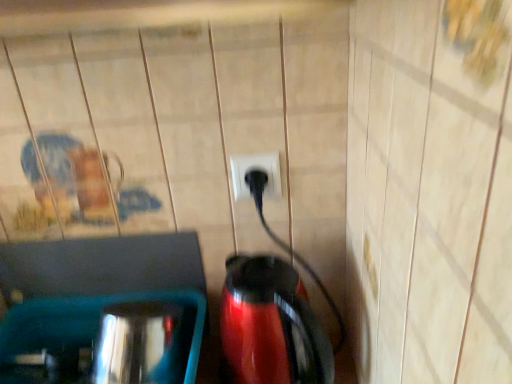
Question: From a real-world perspective, is black plastic plug at center on top of glossy plastic coffee pot at center?

Choices:
 (A) no
 (B) yes

Answer: (B)

Question: Are black plastic plug at center and glossy plastic coffee pot at center far apart?

Choices:
 (A) no
 (B) yes

Answer: (A)

Question: Is black plastic plug at center further to the viewer compared to glossy plastic coffee pot at center?

Choices:
 (A) yes
 (B) no

Answer: (A)

Question: Is black plastic plug at center completely or partially outside of glossy plastic coffee pot at center?

Choices:
 (A) no
 (B) yes

Answer: (B)

Question: Is black plastic plug at center to the left of glossy plastic coffee pot at center from the viewer's perspective?

Choices:
 (A) no
 (B) yes

Answer: (B)

Question: Is black plastic plug at center facing towards glossy plastic coffee pot at center?

Choices:
 (A) yes
 (B) no

Answer: (B)

Question: Is glossy plastic coffee pot at center smaller than black plastic plug at center?

Choices:
 (A) yes
 (B) no

Answer: (B)

Question: Can you confirm if glossy plastic coffee pot at center is wider than black plastic plug at center?

Choices:
 (A) no
 (B) yes

Answer: (B)

Question: From a real-world perspective, is glossy plastic coffee pot at center on black plastic plug at center?

Choices:
 (A) no
 (B) yes

Answer: (A)

Question: Is glossy plastic coffee pot at center to the left of black plastic plug at center from the viewer's perspective?

Choices:
 (A) no
 (B) yes

Answer: (A)

Question: Is glossy plastic coffee pot at center facing towards black plastic plug at center?

Choices:
 (A) yes
 (B) no

Answer: (B)

Question: Does glossy plastic coffee pot at center have a lesser height compared to black plastic plug at center?

Choices:
 (A) no
 (B) yes

Answer: (A)

Question: From the image's perspective, is glossy plastic coffee pot at center positioned above or below black plastic plug at center?

Choices:
 (A) above
 (B) below

Answer: (B)